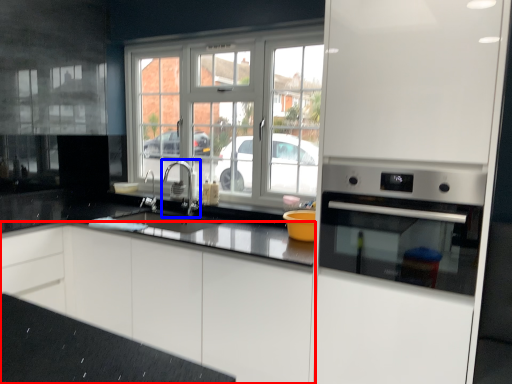
Question: Which of the following is the closest to the observer, cabinetry (highlighted by a red box) or tap (highlighted by a blue box)?

Choices:
 (A) cabinetry
 (B) tap

Answer: (A)